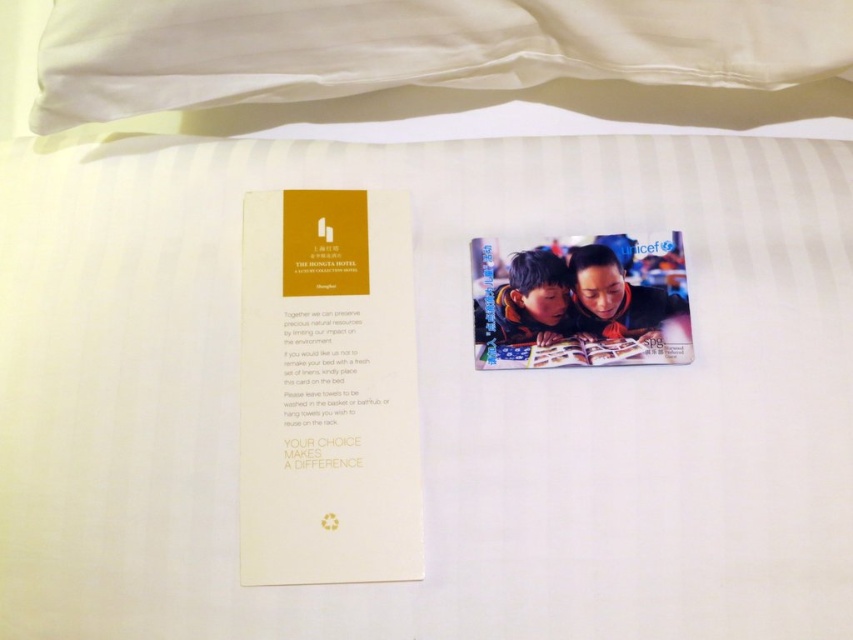
Question: Which point is farther to the camera?

Choices:
 (A) white soft pillow at upper center
 (B) matte plastic magazine at center

Answer: (B)

Question: Can you confirm if white soft pillow at upper center is bigger than matte plastic magazine at center?

Choices:
 (A) yes
 (B) no

Answer: (A)

Question: Does gold paper card at left appear on the left side of matte plastic magazine at center?

Choices:
 (A) yes
 (B) no

Answer: (A)

Question: Considering the real-world distances, which object is farthest from the gold paper card at left?

Choices:
 (A) white soft pillow at upper center
 (B) matte plastic magazine at center

Answer: (A)

Question: Which is nearer to the white soft pillow at upper center?

Choices:
 (A) gold paper card at left
 (B) matte plastic magazine at center

Answer: (B)

Question: In this image, where is gold paper card at left located relative to matte plastic magazine at center?

Choices:
 (A) right
 (B) left

Answer: (B)